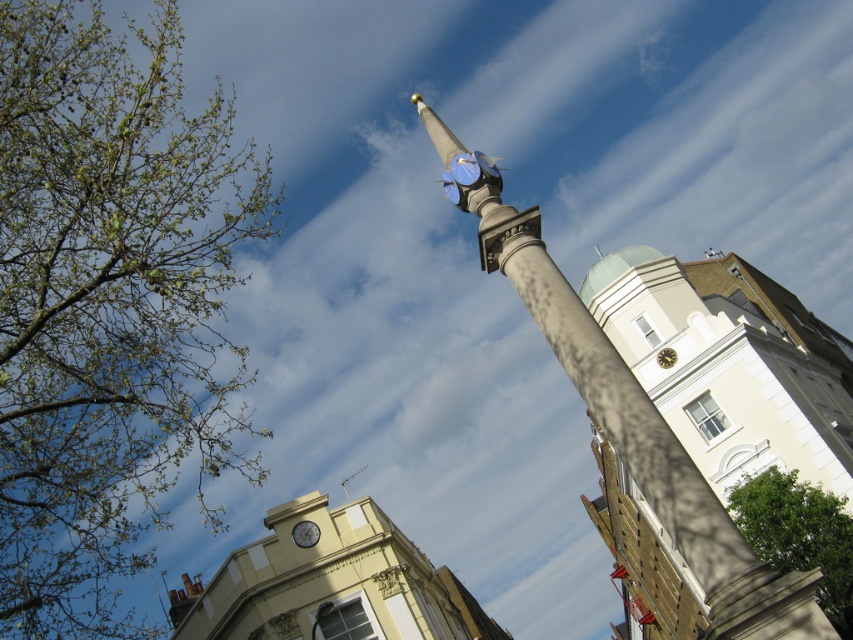
Question: Does smooth stone pole at center appear over matte silver clock at center?

Choices:
 (A) yes
 (B) no

Answer: (A)

Question: Estimate the real-world distances between objects in this image. Which object is farther from the green leafy branches at upper left?

Choices:
 (A) light beige stone clock tower at upper center
 (B) green leafy tree at lower right
 (C) matte gray pole at center

Answer: (C)

Question: Which of the following is the farthest from the observer?

Choices:
 (A) (314, 618)
 (B) (689, 413)
 (C) (456, 172)

Answer: (B)

Question: From the image, what is the correct spatial relationship of matte silver clock at center in relation to matte gray pole at center?

Choices:
 (A) left
 (B) right

Answer: (A)

Question: Estimate the real-world distances between objects in this image. Which object is farther from the green leafy branches at upper left?

Choices:
 (A) green leafy tree at lower right
 (B) smooth stone pole at center
 (C) matte silver clock at center
 (D) light beige stone clock tower at upper center

Answer: (A)

Question: Does light beige stone clock tower at upper center come behind smooth stone pole at center?

Choices:
 (A) yes
 (B) no

Answer: (A)